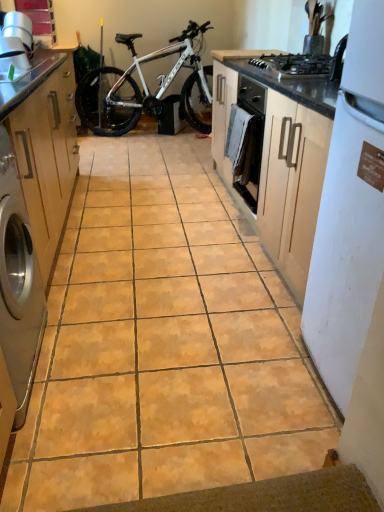
Question: Can you confirm if white matte refrigerator at right is smaller than matte wood cabinet at left?

Choices:
 (A) yes
 (B) no

Answer: (A)

Question: Would you say white matte refrigerator at right is outside matte wood cabinet at left?

Choices:
 (A) yes
 (B) no

Answer: (A)

Question: Is white matte refrigerator at right facing towards matte wood cabinet at left?

Choices:
 (A) no
 (B) yes

Answer: (A)

Question: Does white matte refrigerator at right contain matte wood cabinet at left?

Choices:
 (A) yes
 (B) no

Answer: (B)

Question: Is white matte refrigerator at right next to matte wood cabinet at left?

Choices:
 (A) yes
 (B) no

Answer: (B)

Question: In terms of size, does satin silver washing machine at left appear bigger or smaller than black matte gas stove at upper right?

Choices:
 (A) big
 (B) small

Answer: (A)

Question: From the image's perspective, is satin silver washing machine at left positioned above or below black matte gas stove at upper right?

Choices:
 (A) above
 (B) below

Answer: (B)

Question: Would you say satin silver washing machine at left is to the left or to the right of black matte gas stove at upper right in the picture?

Choices:
 (A) right
 (B) left

Answer: (B)

Question: In terms of height, does satin silver washing machine at left look taller or shorter compared to black matte gas stove at upper right?

Choices:
 (A) tall
 (B) short

Answer: (A)

Question: In terms of height, does black matte gas stove at upper right look taller or shorter compared to matte wood cabinet at left?

Choices:
 (A) short
 (B) tall

Answer: (A)

Question: Considering the positions of point pyautogui.click(x=339, y=64) and point pyautogui.click(x=19, y=125), is point pyautogui.click(x=339, y=64) closer or farther from the camera than point pyautogui.click(x=19, y=125)?

Choices:
 (A) farther
 (B) closer

Answer: (A)

Question: Based on their sizes in the image, would you say black matte gas stove at upper right is bigger or smaller than matte wood cabinet at left?

Choices:
 (A) big
 (B) small

Answer: (B)

Question: From the image's perspective, is black matte gas stove at upper right positioned above or below matte wood cabinet at left?

Choices:
 (A) above
 (B) below

Answer: (A)

Question: Considering the positions of satin silver washing machine at left and white matte bicycle at center in the image, is satin silver washing machine at left taller or shorter than white matte bicycle at center?

Choices:
 (A) short
 (B) tall

Answer: (A)

Question: From the image's perspective, is satin silver washing machine at left positioned above or below white matte bicycle at center?

Choices:
 (A) above
 (B) below

Answer: (B)